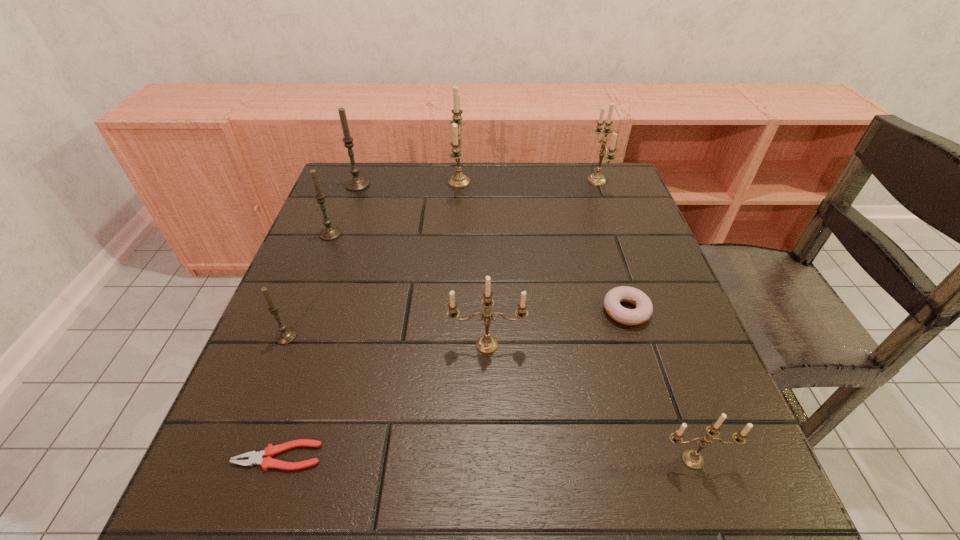
The height and width of the screenshot is (540, 960). In the image, there is a desktop. In order to click on vacant area at the far edge in this screenshot , I will do `click(434, 181)`.

The height and width of the screenshot is (540, 960). In the image, there is a desktop. Find the location of `vacant space at the near edge`. vacant space at the near edge is located at coordinates (539, 532).

The width and height of the screenshot is (960, 540). I want to click on free space at the left edge, so click(358, 223).

In the image, there is a desktop. Where is `vacant space at the right edge`? The height and width of the screenshot is (540, 960). vacant space at the right edge is located at coordinates (660, 274).

The image size is (960, 540). In the image, there is a desktop. What are the coordinates of `free region at the far left corner` in the screenshot? It's located at (381, 163).

This screenshot has width=960, height=540. In the image, there is a desktop. What are the coordinates of `vacant space at the far right corner` in the screenshot? It's located at (613, 183).

Where is `free space between the smallest metallic candle and the shortest object`? The image size is (960, 540). free space between the smallest metallic candle and the shortest object is located at coordinates (485, 458).

What are the coordinates of `vacant area that lies between the smallest gray candle and the third biggest metallic candle` in the screenshot? It's located at (387, 341).

You are a GUI agent. You are given a task and a screenshot of the screen. Output one action in this format:
    pyautogui.click(x=<x>, y=<y>)
    Task: Click on the empty space between the biggest metallic candle and the second farthest gray candle
    
    Given the screenshot: What is the action you would take?
    pyautogui.click(x=395, y=208)

Identify the location of free area in between the third biggest metallic candle and the third smallest metallic candle. (541, 262).